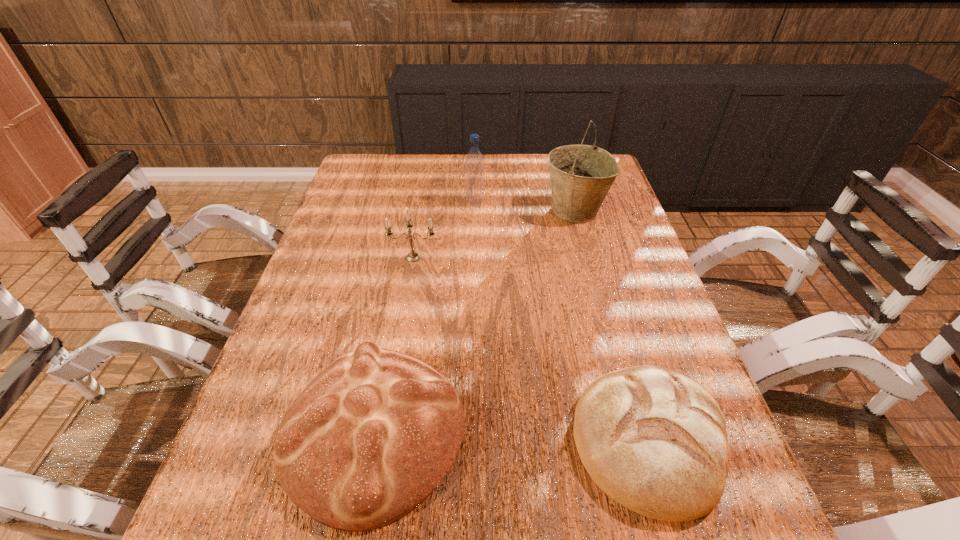
Image resolution: width=960 pixels, height=540 pixels. Find the location of `free space between the taller bread and the water bottle`. free space between the taller bread and the water bottle is located at coordinates pyautogui.click(x=424, y=318).

Find the location of a particular element. The height and width of the screenshot is (540, 960). vacant space that's between the fourth shortest object and the third shortest object is located at coordinates (444, 231).

Locate which object ranks in proximity to the water bottle. Please provide its 2D coordinates. Your answer should be formatted as a tuple, i.e. [(x, y)], where the tuple contains the x and y coordinates of a point satisfying the conditions above.

[(581, 175)]

This screenshot has width=960, height=540. In order to click on object that ranks as the fourth closest to the third nearest object in this screenshot , I will do `click(653, 439)`.

Locate an element on the screen. Image resolution: width=960 pixels, height=540 pixels. vacant space that satisfies the following two spatial constraints: 1. on the front side of the shortest object; 2. on the right side of the fourth shortest object is located at coordinates (471, 440).

In order to click on free space in the image that satisfies the following two spatial constraints: 1. on the back side of the taller bread; 2. on the right side of the third nearest object in this screenshot , I will do `click(407, 258)`.